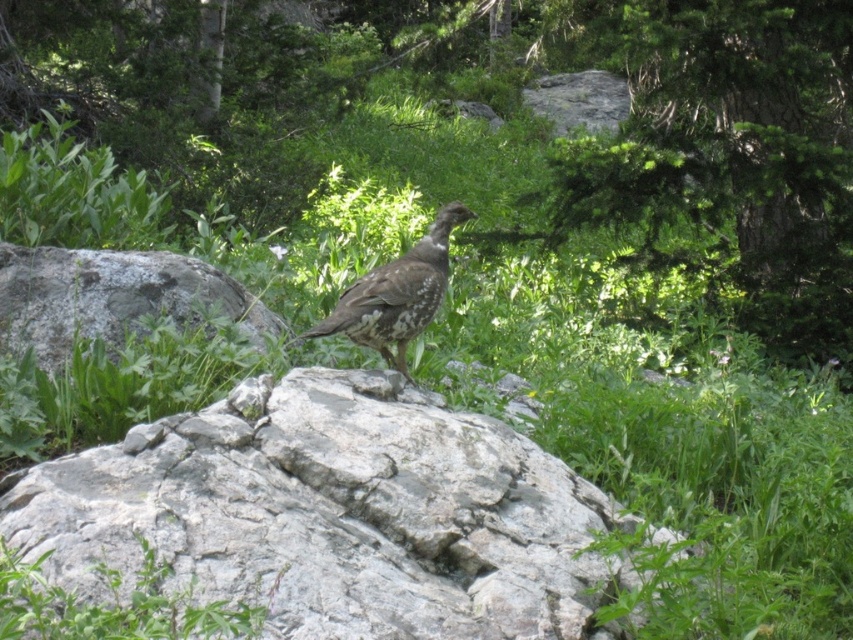
Question: Does gray rough boulder at center come in front of speckled brown bird at center?

Choices:
 (A) yes
 (B) no

Answer: (B)

Question: Which of these objects is positioned closest to the gray rough boulder at center?

Choices:
 (A) speckled brown bird at center
 (B) gray rock at center
 (C) green textured tree at upper center

Answer: (A)

Question: Is gray rough boulder at center closer to the viewer compared to speckled brown bird at center?

Choices:
 (A) yes
 (B) no

Answer: (B)

Question: Which object is closer to the camera taking this photo?

Choices:
 (A) green textured tree at upper center
 (B) gray rough boulder at center
 (C) gray rock at center

Answer: (C)

Question: Does green textured tree at upper center appear on the right side of speckled brown bird at center?

Choices:
 (A) yes
 (B) no

Answer: (A)

Question: Among these objects, which one is nearest to the camera?

Choices:
 (A) gray rock at center
 (B) gray rough boulder at center

Answer: (A)